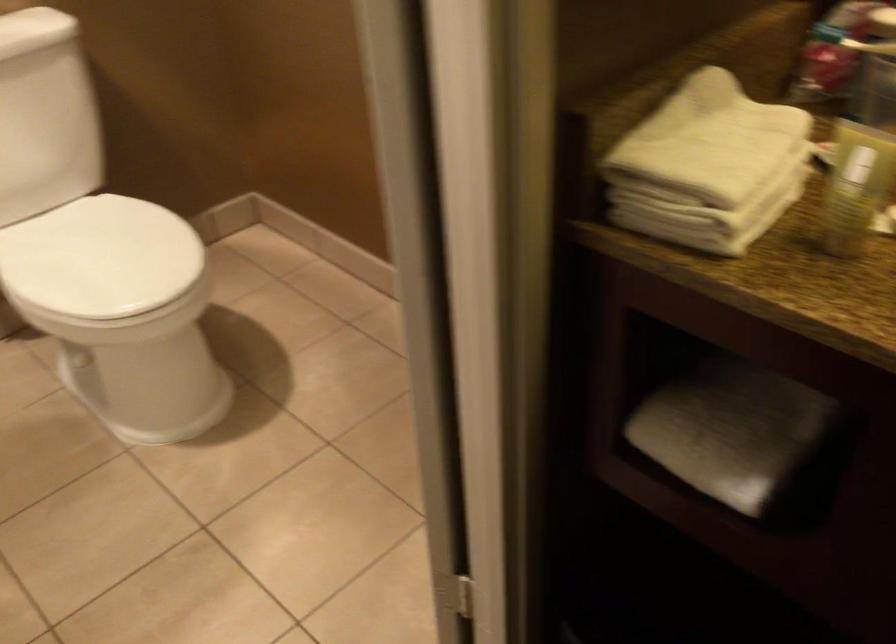
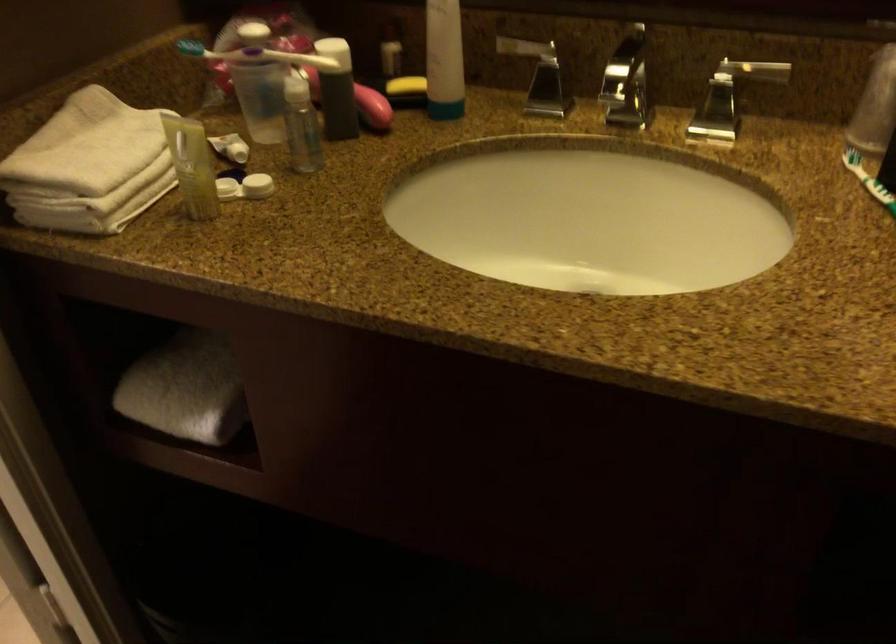
The point at (726, 440) is marked in the first image. Where is the corresponding point in the second image?

(185, 389)